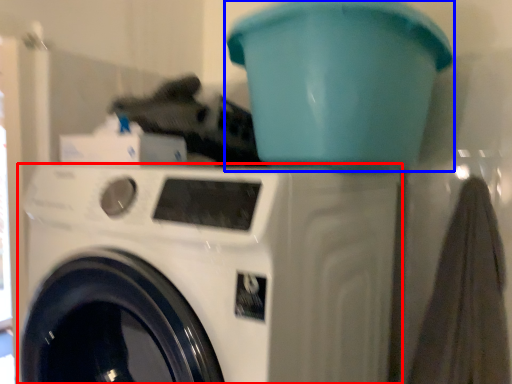
Question: Which object appears farthest to the camera in this image, washing machine (highlighted by a red box) or water cooler (highlighted by a blue box)?

Choices:
 (A) washing machine
 (B) water cooler

Answer: (B)